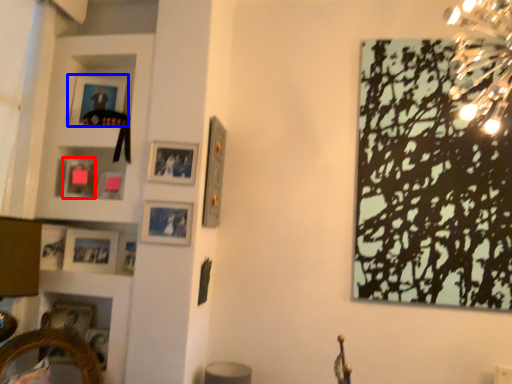
Question: Which object appears farthest to the camera in this image, picture frame (highlighted by a red box) or picture frame (highlighted by a blue box)?

Choices:
 (A) picture frame
 (B) picture frame

Answer: (B)